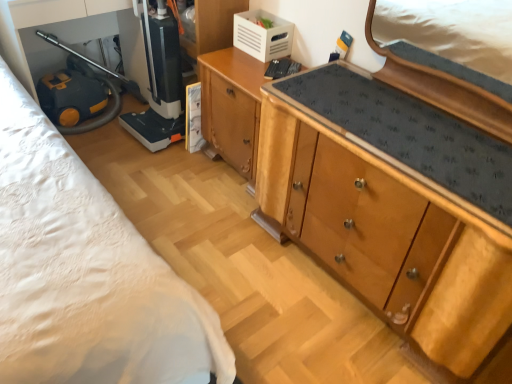
Question: From a real-world perspective, does black plastic vacuum cleaner at lower left, acting as the 1th appliance starting from the left, sit lower than wooden cabinet at center, placed as the 2th cabinetry when sorted from left to right?

Choices:
 (A) no
 (B) yes

Answer: (A)

Question: Is black plastic vacuum cleaner at lower left, acting as the 1th appliance starting from the left, shorter than wooden cabinet at center, placed as the 2th cabinetry when sorted from left to right?

Choices:
 (A) yes
 (B) no

Answer: (B)

Question: Is black plastic vacuum cleaner at lower left, acting as the 1th appliance starting from the left, thinner than wooden cabinet at center, placed as the 2th cabinetry when sorted from left to right?

Choices:
 (A) no
 (B) yes

Answer: (B)

Question: Does black plastic vacuum cleaner at lower left, acting as the 1th appliance starting from the left, have a greater height compared to wooden cabinet at center, which appears as the 1th cabinetry when viewed from the right?

Choices:
 (A) yes
 (B) no

Answer: (A)

Question: Can you confirm if black plastic vacuum cleaner at lower left, acting as the 1th appliance starting from the left, is smaller than wooden cabinet at center, placed as the 2th cabinetry when sorted from left to right?

Choices:
 (A) yes
 (B) no

Answer: (A)

Question: From a real-world perspective, is black plastic vacuum cleaner at lower left, acting as the 1th appliance starting from the left, physically above wooden cabinet at center, placed as the 2th cabinetry when sorted from left to right?

Choices:
 (A) no
 (B) yes

Answer: (B)

Question: Is white plastic crate at upper center, the 1th appliance positioned from the right, facing away from wooden cabinet at center, placed as the 2th cabinetry when sorted from left to right?

Choices:
 (A) yes
 (B) no

Answer: (B)

Question: Is white plastic crate at upper center, the 1th appliance positioned from the right, positioned behind wooden cabinet at center, placed as the 2th cabinetry when sorted from left to right?

Choices:
 (A) yes
 (B) no

Answer: (A)

Question: Is the position of white plastic crate at upper center, the 1th appliance positioned from the right, less distant than that of wooden cabinet at center, which appears as the 1th cabinetry when viewed from the right?

Choices:
 (A) no
 (B) yes

Answer: (A)

Question: Is white plastic crate at upper center, the 1th appliance positioned from the right, thinner than wooden cabinet at center, which appears as the 1th cabinetry when viewed from the right?

Choices:
 (A) no
 (B) yes

Answer: (B)

Question: Is white plastic crate at upper center, the 1th appliance positioned from the right, smaller than wooden cabinet at center, placed as the 2th cabinetry when sorted from left to right?

Choices:
 (A) no
 (B) yes

Answer: (B)

Question: Does white plastic crate at upper center, the 1th appliance positioned from the right, have a greater height compared to wooden cabinet at center, placed as the 2th cabinetry when sorted from left to right?

Choices:
 (A) no
 (B) yes

Answer: (A)

Question: From a real-world perspective, is black plastic vacuum cleaner at lower left, the 2th appliance in the right-to-left sequence, located higher than wooden cabinet at center, arranged as the 2th cabinetry when viewed from the right?

Choices:
 (A) yes
 (B) no

Answer: (A)